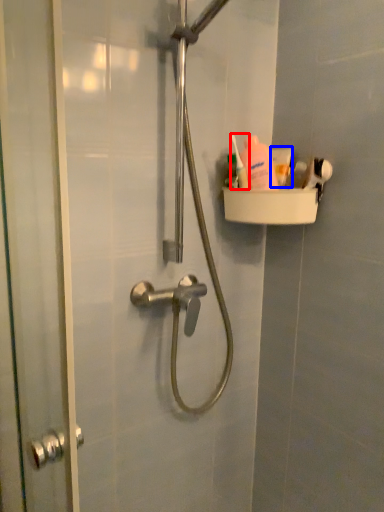
Question: Which of the following is the farthest to the observer, toiletry (highlighted by a red box) or toothpaste (highlighted by a blue box)?

Choices:
 (A) toiletry
 (B) toothpaste

Answer: (B)